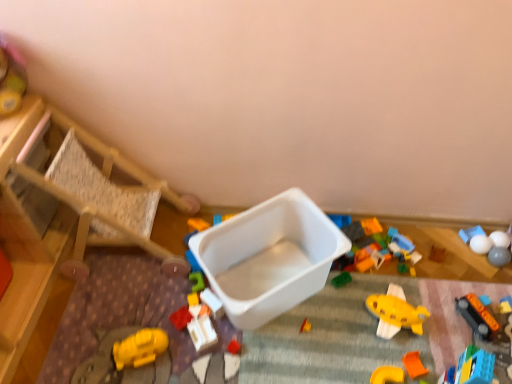
Image resolution: width=512 pixels, height=384 pixels. I want to click on free spot to the left of rubberized plastic toy at center, which ranks as the 2th toy in left-to-right order, so click(129, 317).